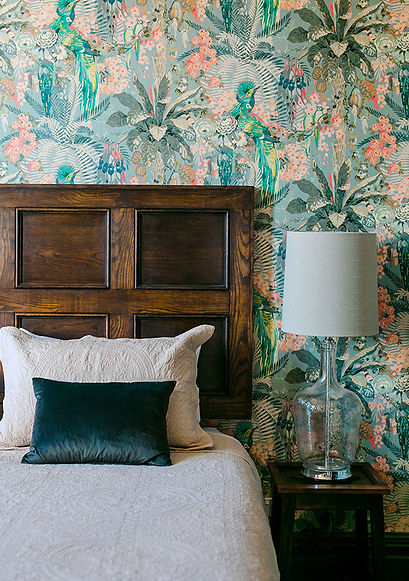
Find the location of a particular element. The height and width of the screenshot is (581, 409). bed is located at coordinates (164, 550).